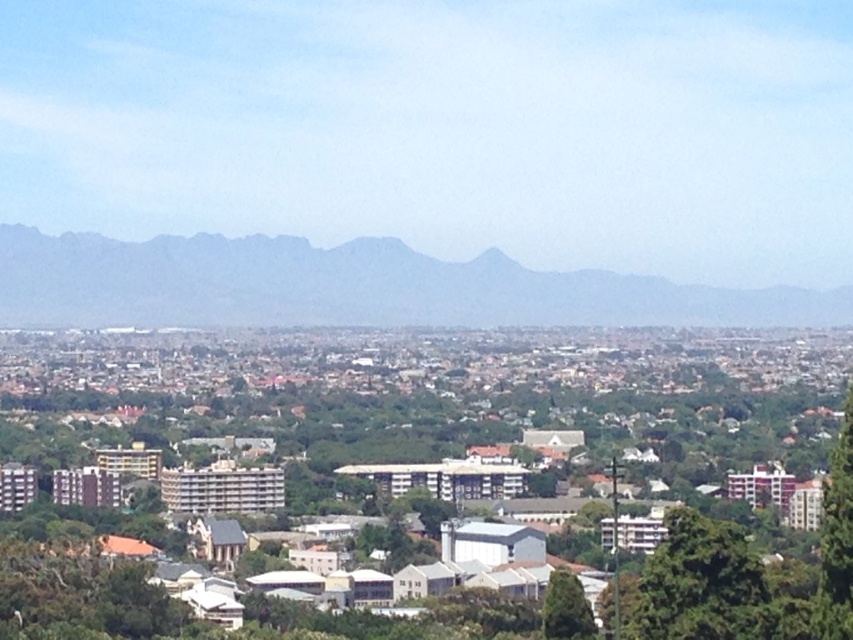
Question: Does gray rocky mountain at center lie behind green leafy tree at lower right?

Choices:
 (A) no
 (B) yes

Answer: (A)

Question: Observing the image, what is the correct spatial positioning of green leafy tree at lower right in reference to green leafy tree at lower center?

Choices:
 (A) left
 (B) right

Answer: (B)

Question: Among these points, which one is farthest from the camera?

Choices:
 (A) [596, 627]
 (B) [827, 628]
 (C) [305, 264]
 (D) [699, 608]

Answer: (D)

Question: Based on their relative distances, which object is farther from the gray rocky mountain at center?

Choices:
 (A) green leafy tree at lower center
 (B) green leafy tree at right
 (C) green leafy tree at lower right

Answer: (B)

Question: Which object appears closest to the camera in this image?

Choices:
 (A) green leafy tree at lower right
 (B) green leafy tree at right

Answer: (A)

Question: Is green leafy tree at lower right positioned at the back of green leafy tree at lower center?

Choices:
 (A) no
 (B) yes

Answer: (B)